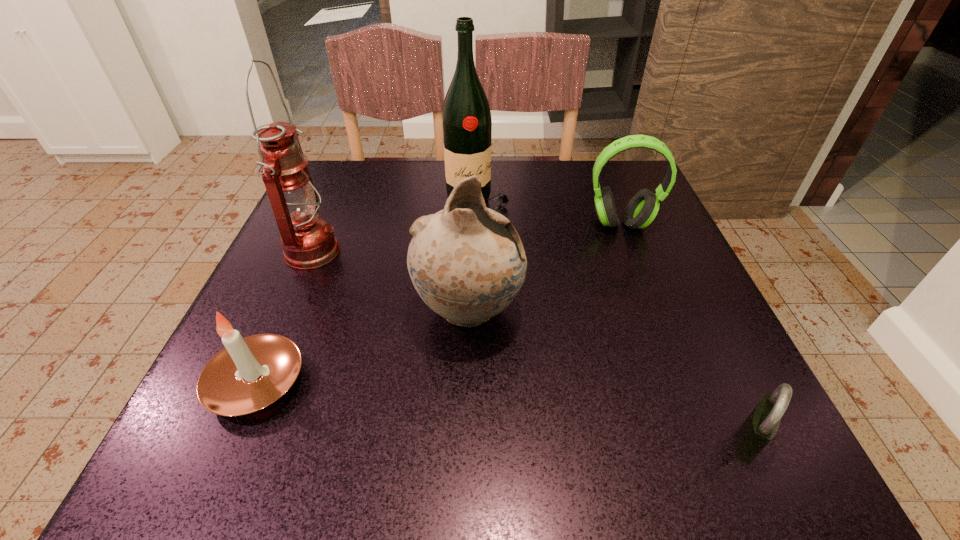
Identify the location of object at the near left corner. (249, 374).

You are a GUI agent. You are given a task and a screenshot of the screen. Output one action in this format:
    pyautogui.click(x=<x>, y=<y>)
    Task: Click on the object situated at the far right corner
    
    Given the screenshot: What is the action you would take?
    pyautogui.click(x=643, y=207)

Locate an element on the screen. object that is at the near right corner is located at coordinates (761, 425).

What are the coordinates of `free spot at the far edge of the desktop` in the screenshot? It's located at (381, 192).

Locate an element on the screen. The width and height of the screenshot is (960, 540). vacant space at the near edge is located at coordinates (575, 435).

Locate an element on the screen. free space at the right edge of the desktop is located at coordinates (655, 407).

This screenshot has width=960, height=540. I want to click on free spot between the third tallest object and the second shortest object, so click(x=363, y=346).

Locate an element on the screen. vacant region between the padlock and the pottery is located at coordinates (609, 375).

At what (x,y) coordinates should I click in order to perform the action: click on blank region between the fourth shortest object and the oil lamp. Please return your answer as a coordinate pair (x, y). Looking at the image, I should click on click(391, 281).

The width and height of the screenshot is (960, 540). I want to click on vacant area that lies between the fourth shortest object and the oil lamp, so click(x=391, y=281).